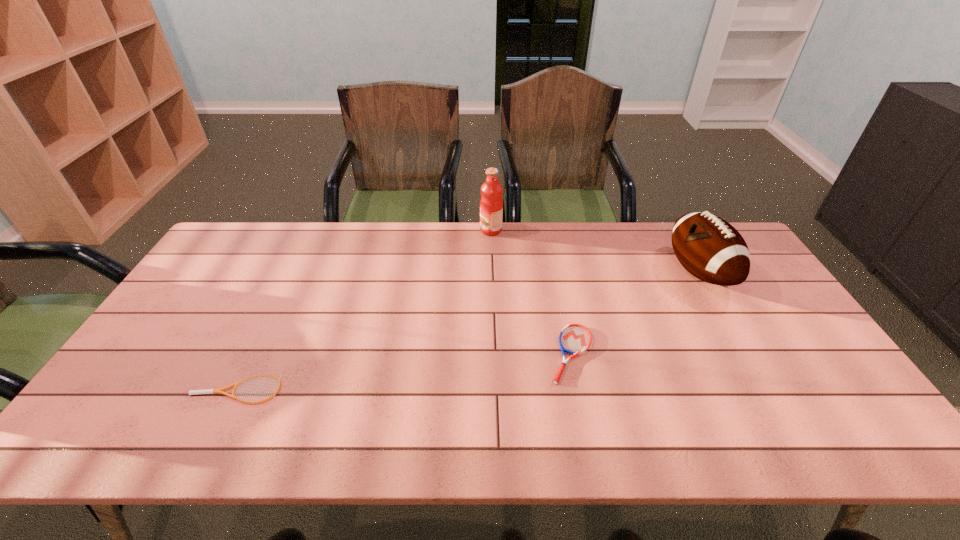
Find the location of a particular element. The image size is (960, 540). the third object from right to left is located at coordinates (491, 203).

Where is `the tallest object`? The width and height of the screenshot is (960, 540). the tallest object is located at coordinates (491, 203).

This screenshot has height=540, width=960. In order to click on the third shortest object in this screenshot , I will do `click(712, 250)`.

The height and width of the screenshot is (540, 960). What are the coordinates of `football (American)` in the screenshot? It's located at (712, 250).

This screenshot has width=960, height=540. I want to click on the right tennis racket, so (x=574, y=339).

What are the coordinates of `the leftmost object` in the screenshot? It's located at (x=207, y=391).

Identify the location of free space located on the front label of the tallest object. The width and height of the screenshot is (960, 540). (392, 230).

I want to click on vacant space located 0.190m on the front label of the tallest object, so click(427, 230).

Where is `vacant area situated on the front label of the tallest object`? Image resolution: width=960 pixels, height=540 pixels. vacant area situated on the front label of the tallest object is located at coordinates (386, 230).

At what (x,y) coordinates should I click in order to perform the action: click on vacant space located 0.210m on the front of the third nearest object. Please return your answer as a coordinate pair (x, y). Looking at the image, I should click on (752, 363).